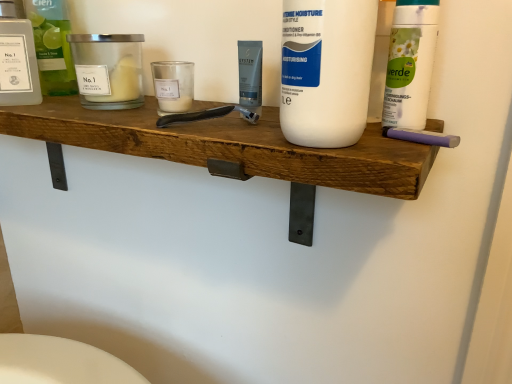
Question: Is white matte bottle at center, the second cleaning product viewed from the left, to the right of translucent glass bottle at upper left, placed as the third cleaning product when sorted from front to back, from the viewer's perspective?

Choices:
 (A) yes
 (B) no

Answer: (A)

Question: Is white matte bottle at center, marked as the 1th cleaning product in a front-to-back arrangement, directly adjacent to translucent glass bottle at upper left, arranged as the first cleaning product when viewed from the back?

Choices:
 (A) no
 (B) yes

Answer: (A)

Question: Is white matte bottle at center, which is the second cleaning product in right-to-left order, not inside translucent glass bottle at upper left, which is counted as the 3th cleaning product, starting from the right?

Choices:
 (A) yes
 (B) no

Answer: (A)

Question: From a real-world perspective, is white matte bottle at center, which is the second cleaning product in right-to-left order, physically below translucent glass bottle at upper left, which appears as the 1th cleaning product when viewed from the left?

Choices:
 (A) yes
 (B) no

Answer: (B)

Question: Does white matte bottle at center, marked as the 1th cleaning product in a front-to-back arrangement, have a smaller size compared to translucent glass bottle at upper left, which appears as the 1th cleaning product when viewed from the left?

Choices:
 (A) yes
 (B) no

Answer: (B)

Question: Does white matte bottle at center, which is the second cleaning product in right-to-left order, have a lesser height compared to translucent glass bottle at upper left, arranged as the first cleaning product when viewed from the back?

Choices:
 (A) yes
 (B) no

Answer: (B)

Question: Does white matte bottle at center, marked as the 1th cleaning product in a front-to-back arrangement, come in front of matte glass candle at left, which is the 2th personal care from left to right?

Choices:
 (A) yes
 (B) no

Answer: (A)

Question: Could matte glass candle at left, which is the 2th personal care from left to right, be considered to be inside white matte bottle at center, which is the second cleaning product in right-to-left order?

Choices:
 (A) no
 (B) yes

Answer: (A)

Question: Is the depth of white matte bottle at center, the second cleaning product viewed from the left, greater than that of matte glass candle at left, which is the 2th personal care from left to right?

Choices:
 (A) yes
 (B) no

Answer: (B)

Question: Is white matte bottle at center, the second cleaning product viewed from the left, aimed at matte glass candle at left, which is the 2th personal care from left to right?

Choices:
 (A) no
 (B) yes

Answer: (A)

Question: Can you confirm if white matte bottle at center, the second cleaning product viewed from the left, is bigger than matte glass candle at left, which is the 2th personal care from left to right?

Choices:
 (A) yes
 (B) no

Answer: (A)

Question: Can you confirm if white matte bottle at center, marked as the 1th cleaning product in a front-to-back arrangement, is shorter than matte glass candle at left, which is the 2th personal care from left to right?

Choices:
 (A) yes
 (B) no

Answer: (B)

Question: From a real-world perspective, is matte glass candle at left, which is the 2th personal care from left to right, beneath wooden shelf at center?

Choices:
 (A) no
 (B) yes

Answer: (A)